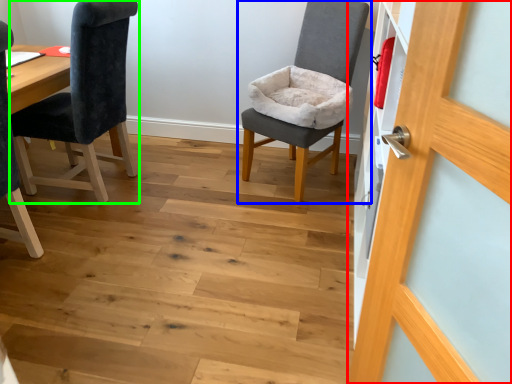
Question: Considering the real-world distances, which object is closest to door (highlighted by a red box)? chair (highlighted by a blue box) or chair (highlighted by a green box).

Choices:
 (A) chair
 (B) chair

Answer: (A)